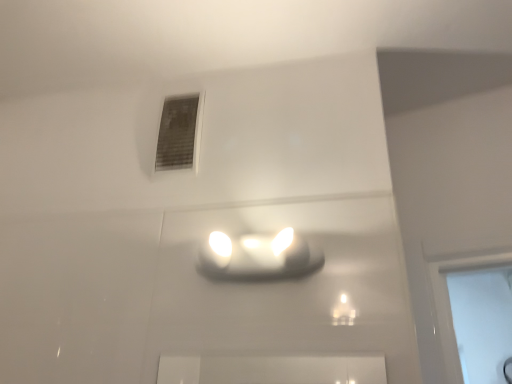
Question: From a real-world perspective, is matte gray vent at upper center positioned above or below matte white lamp at center?

Choices:
 (A) above
 (B) below

Answer: (A)

Question: Considering the positions of matte gray vent at upper center and matte white lamp at center in the image, is matte gray vent at upper center wider or thinner than matte white lamp at center?

Choices:
 (A) wide
 (B) thin

Answer: (B)

Question: In the image, is matte gray vent at upper center positioned in front of or behind matte white lamp at center?

Choices:
 (A) behind
 (B) front

Answer: (A)

Question: Is matte white lamp at center inside or outside of matte gray vent at upper center?

Choices:
 (A) inside
 (B) outside

Answer: (B)

Question: Would you say matte white lamp at center is to the left or to the right of matte gray vent at upper center in the picture?

Choices:
 (A) right
 (B) left

Answer: (A)

Question: From the image's perspective, is matte white lamp at center located above or below matte gray vent at upper center?

Choices:
 (A) above
 (B) below

Answer: (B)

Question: Is matte white lamp at center bigger or smaller than matte gray vent at upper center?

Choices:
 (A) big
 (B) small

Answer: (A)